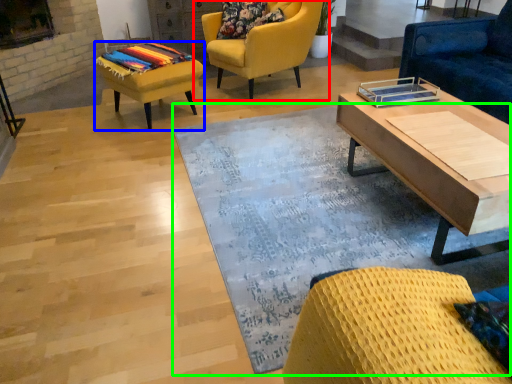
Question: Which object is positioned closest to chair (highlighted by a red box)? Select from stool (highlighted by a blue box) and mat (highlighted by a green box).

Choices:
 (A) stool
 (B) mat

Answer: (A)